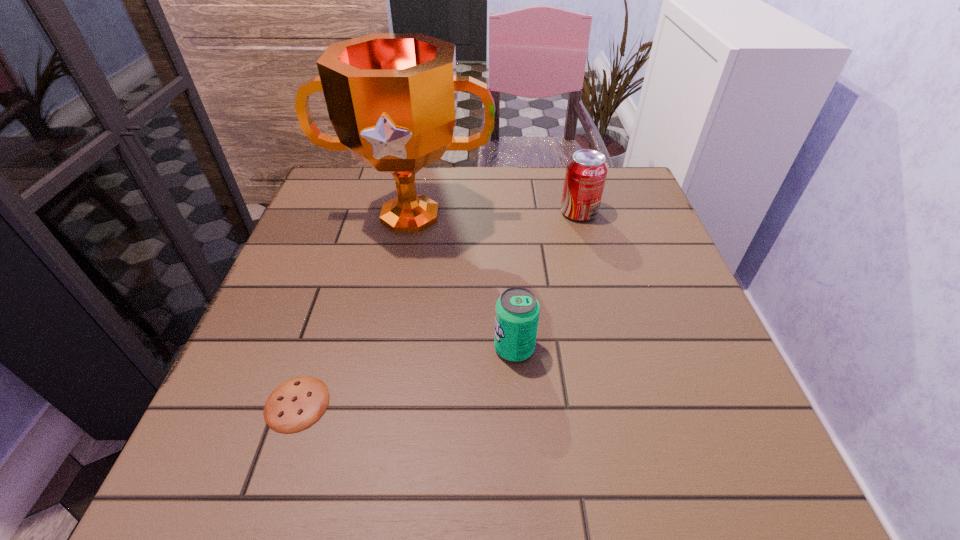
You are a GUI agent. You are given a task and a screenshot of the screen. Output one action in this format:
    pyautogui.click(x=<x>, y=<y>)
    Task: Click on the award
    This screenshot has width=960, height=540.
    Given the screenshot: What is the action you would take?
    pyautogui.click(x=391, y=97)

You are a GUI agent. You are given a task and a screenshot of the screen. Output one action in this format:
    pyautogui.click(x=<x>, y=<y>)
    Task: Click on the taller pop soda
    This screenshot has height=540, width=960.
    Given the screenshot: What is the action you would take?
    pyautogui.click(x=586, y=171)

The height and width of the screenshot is (540, 960). Identify the location of the right pop soda. (586, 171).

At what (x,y) coordinates should I click in order to perform the action: click on the nearer pop soda. Please return your answer as a coordinate pair (x, y). Looking at the image, I should click on (517, 312).

The height and width of the screenshot is (540, 960). What are the coordinates of `the second nearest object` in the screenshot? It's located at (517, 312).

This screenshot has height=540, width=960. I want to click on the shortest object, so click(x=295, y=405).

Where is `the nearest object`? The width and height of the screenshot is (960, 540). the nearest object is located at coordinates (295, 405).

At what (x,y) coordinates should I click in order to perform the action: click on free space located on the side of the tallest object with the star emblem. Please return your answer as a coordinate pair (x, y). The width and height of the screenshot is (960, 540). Looking at the image, I should click on (379, 377).

Find the location of a particular element. This screenshot has height=540, width=960. vacant area situated on the front of the third shortest object is located at coordinates (612, 332).

The height and width of the screenshot is (540, 960). In order to click on free space located on the front-facing side of the left pop soda in this screenshot , I will do `click(388, 348)`.